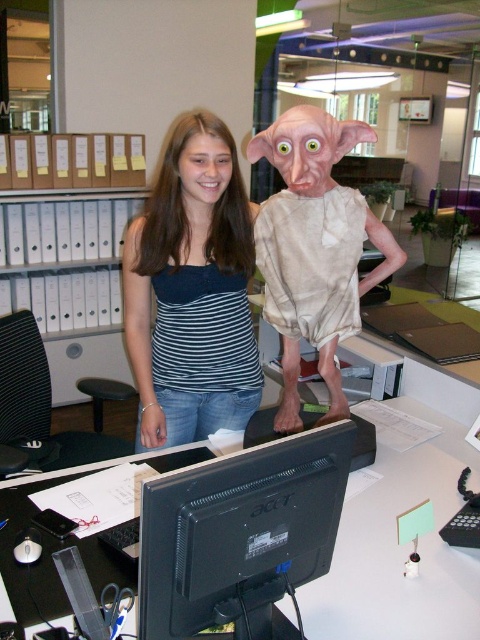
You are a photographer setting up a shoot in this office. You need to position a light source so it illuminates both the striped fabric tank top at center and the black plastic monitor at center without casting shadows. Given their positions, which object should the light be placed closer to?

The black plastic monitor at center is behind the striped fabric tank top at center, so the light should be placed closer to the striped fabric tank top at center to avoid shadows from the tank top blocking the monitor.

You are an office worker who wants to hang a picture frame on the wall behind the striped fabric tank top at center and the black plastic monitor at center. Which object should you position the frame above to ensure it aligns with the current arrangement?

The striped fabric tank top at center is already positioned above the black plastic monitor at center. To maintain alignment with the current arrangement, you should place the picture frame above the striped fabric tank top at center.

You are a fashion designer analyzing the image. You need to determine the exact coordinates of the striped fabric tank top at center. What are its coordinates?

The striped fabric tank top at center is located at coordinates point (192, 291).